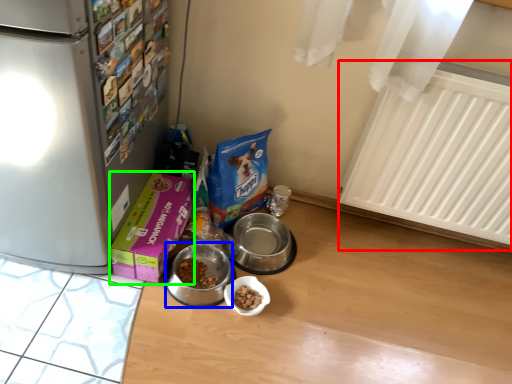
Question: Which object is the farthest from radiator (highlighted by a red box)? Choose among these: appliance (highlighted by a blue box) or box (highlighted by a green box).

Choices:
 (A) appliance
 (B) box

Answer: (B)